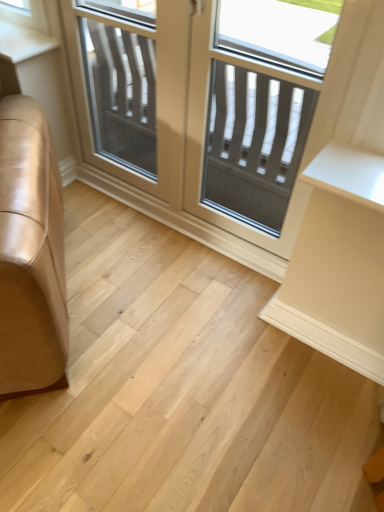
Question: From the image's perspective, is matte gray screen door at center, which is the second screen door in left-to-right order, located above or below clear glass screen door at center, placed as the second screen door when sorted from right to left?

Choices:
 (A) below
 (B) above

Answer: (A)

Question: Looking at the image, does matte gray screen door at center, which is the second screen door in left-to-right order, seem bigger or smaller compared to clear glass screen door at center, placed as the second screen door when sorted from right to left?

Choices:
 (A) small
 (B) big

Answer: (B)

Question: Which object is the closest to the clear glass screen door at center, placed as the second screen door when sorted from right to left?

Choices:
 (A) natural wood floor at lower left
 (B) matte gray screen door at center, arranged as the first screen door when viewed from the right
 (C) clear glass door at center

Answer: (C)

Question: Estimate the real-world distances between objects in this image. Which object is closer to the clear glass door at center?

Choices:
 (A) clear glass screen door at center, placed as the second screen door when sorted from right to left
 (B) matte gray screen door at center, arranged as the first screen door when viewed from the right
 (C) natural wood floor at lower left

Answer: (B)